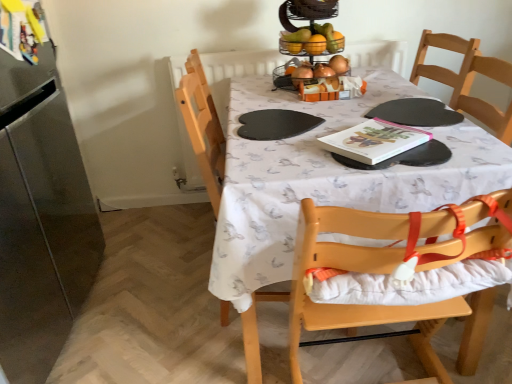
The width and height of the screenshot is (512, 384). Find the location of `vacant area that is situated to the right of hardcover book at center`. vacant area that is situated to the right of hardcover book at center is located at coordinates (467, 140).